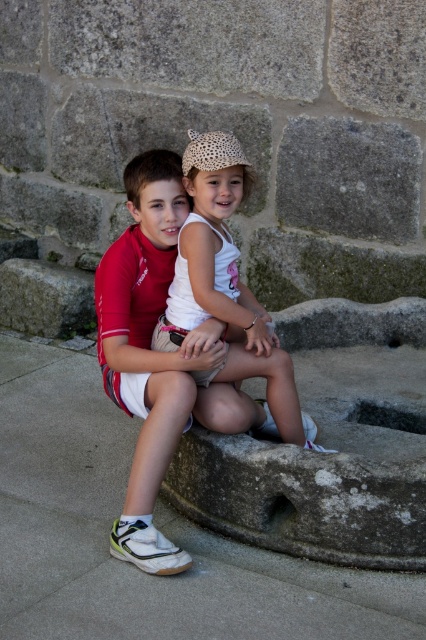
Question: Can you confirm if matte white shirt at center is smaller than gray rough stone at center?

Choices:
 (A) no
 (B) yes

Answer: (A)

Question: Which object appears closest to the camera in this image?

Choices:
 (A) green rough stone at center
 (B) gray rough stone at center
 (C) matte white shirt at center
 (D) white cotton shirt at center

Answer: (C)

Question: Can you confirm if matte white shirt at center is positioned to the right of gray rough stone at center?

Choices:
 (A) no
 (B) yes

Answer: (A)

Question: From the image, what is the correct spatial relationship of white cotton shirt at center in relation to gray rough stone at center?

Choices:
 (A) left
 (B) right

Answer: (A)

Question: Which point is farther from the camera taking this photo?

Choices:
 (A) (209, 365)
 (B) (367, 212)
 (C) (187, 285)
 (D) (49, 276)

Answer: (D)

Question: Considering the real-world distances, which object is closest to the green rough stone at center?

Choices:
 (A) white cotton shirt at center
 (B) matte white shirt at center
 (C) gray rough stone at center

Answer: (C)